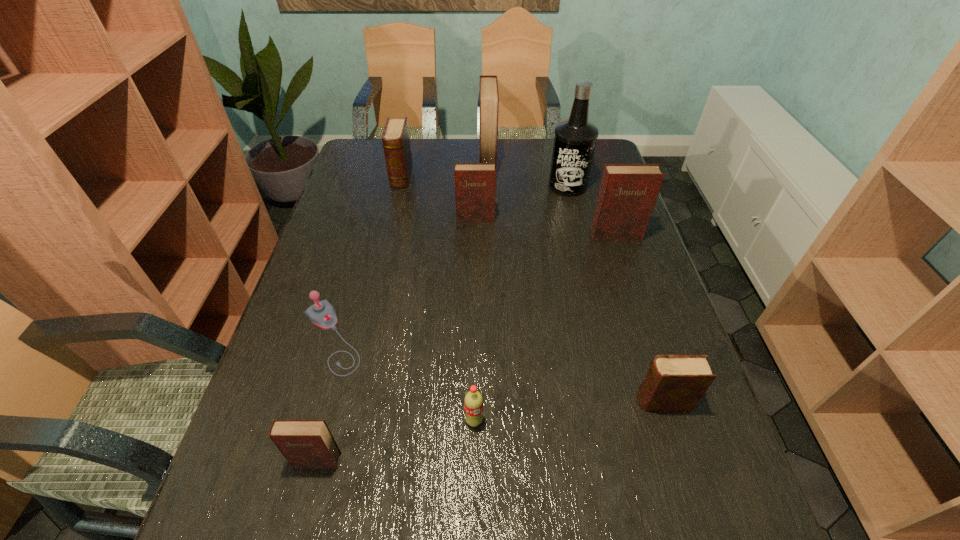
Locate an element on the screen. This screenshot has width=960, height=540. the second nearest diary is located at coordinates coord(673,382).

The width and height of the screenshot is (960, 540). Find the location of `the seventh farthest object`. the seventh farthest object is located at coordinates (673, 382).

You are a GUI agent. You are given a task and a screenshot of the screen. Output one action in this format:
    pyautogui.click(x=<x>, y=<y>)
    Task: Click on the leftmost reddish-brown diary
    
    Given the screenshot: What is the action you would take?
    pyautogui.click(x=304, y=443)

I want to click on the nearest diary, so click(304, 443).

Where is `the second nearest object`? Image resolution: width=960 pixels, height=540 pixels. the second nearest object is located at coordinates click(x=473, y=401).

What are the coordinates of `red soda` in the screenshot? It's located at (473, 401).

Where is `the fourth nearest object`? The image size is (960, 540). the fourth nearest object is located at coordinates (322, 314).

Locate an element on the screen. gray joystick is located at coordinates (322, 314).

Identify the location of free space located on the front label of the tallest object. (592, 289).

At what (x,y) coordinates should I click in order to perform the action: click on vacant area situated on the front cover of the tallest diary. Please return your answer as a coordinate pair (x, y). The image size is (960, 540). Looking at the image, I should click on (372, 163).